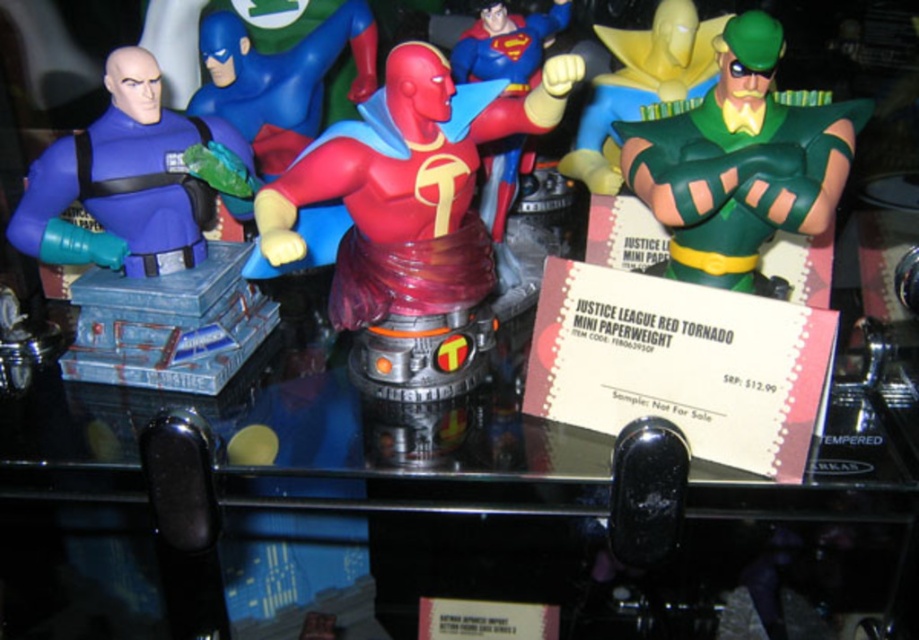
Question: Does clear glass table at center have a lesser width compared to translucent red bust at center?

Choices:
 (A) yes
 (B) no

Answer: (B)

Question: Based on their relative distances, which object is nearer to the clear glass table at center?

Choices:
 (A) matte blue plastic figure at left
 (B) green rubber figure at upper right
 (C) translucent red figure at center
 (D) green rubber mask at upper right

Answer: (A)

Question: Is green rubber mask at upper right above translucent red figure at center?

Choices:
 (A) yes
 (B) no

Answer: (B)

Question: Among these objects, which one is nearest to the camera?

Choices:
 (A) clear glass table at center
 (B) green rubber figure at upper right
 (C) matte blue plastic figure at left

Answer: (A)

Question: Which object appears closest to the camera in this image?

Choices:
 (A) translucent red bust at center
 (B) translucent red figure at center

Answer: (A)

Question: Is translucent red bust at center behind green rubber figure at upper right?

Choices:
 (A) yes
 (B) no

Answer: (B)